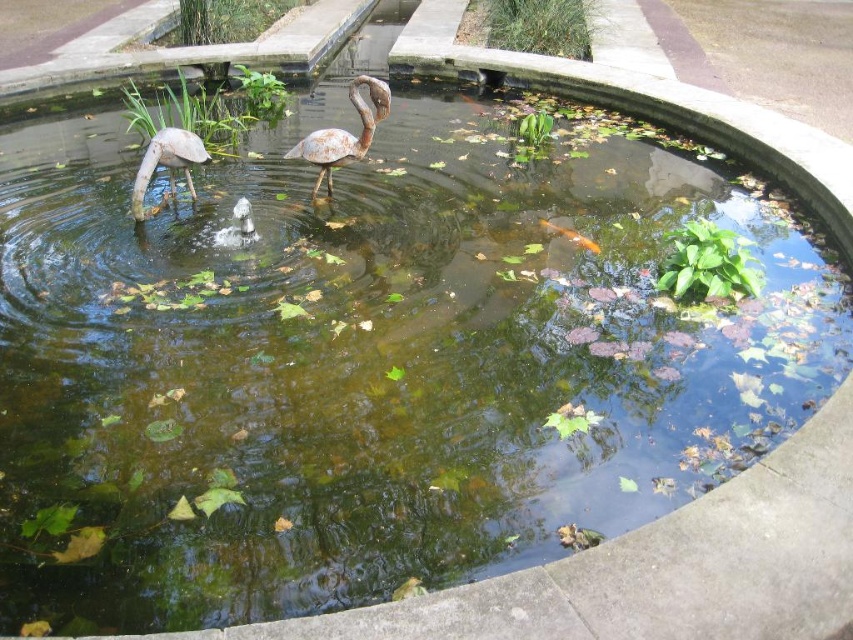
Question: Does rusty metal flamingo at center have a greater width compared to matte white flamingo at left?

Choices:
 (A) no
 (B) yes

Answer: (B)

Question: Is rusty metal flamingo at center in front of matte white flamingo at left?

Choices:
 (A) yes
 (B) no

Answer: (B)

Question: Which point appears farthest from the camera in this image?

Choices:
 (A) (160, 148)
 (B) (364, 80)

Answer: (B)

Question: Can you confirm if rusty metal flamingo at center is positioned to the left of matte white flamingo at left?

Choices:
 (A) no
 (B) yes

Answer: (A)

Question: Which point is closer to the camera?

Choices:
 (A) (370, 115)
 (B) (184, 134)

Answer: (B)